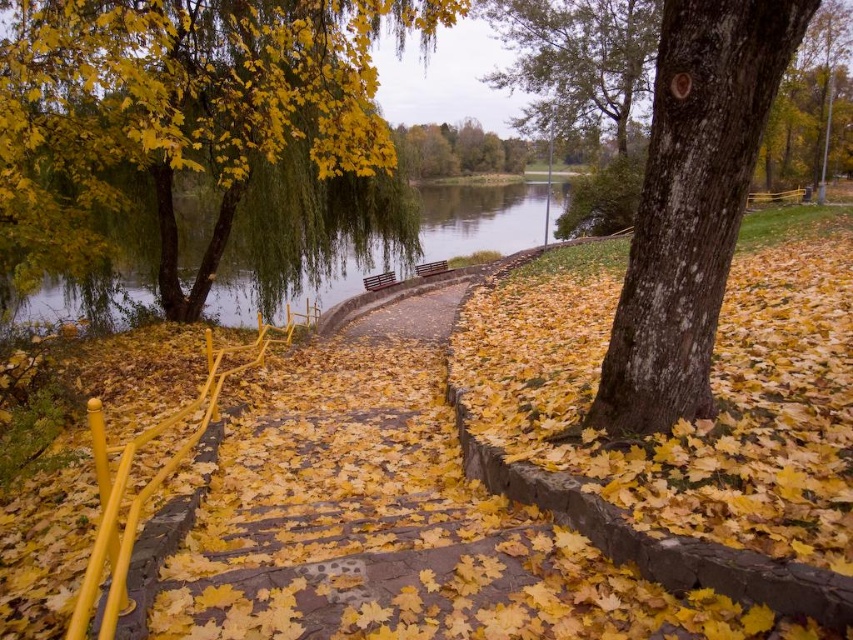
You are standing at the top of the stone steps in the autumn scene. There is a brown wooden bench at center located at point (379, 280). Can you see the bench from your current position?

Yes, the brown wooden bench at center is located at point (379, 280), so it should be visible from the top of the stone steps where you are standing.